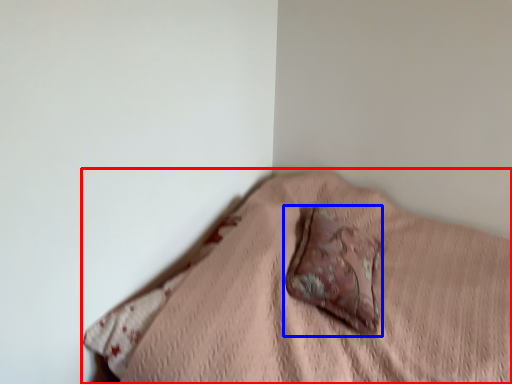
Question: Which object is further to the camera taking this photo, furniture (highlighted by a red box) or throw pillow (highlighted by a blue box)?

Choices:
 (A) furniture
 (B) throw pillow

Answer: (B)